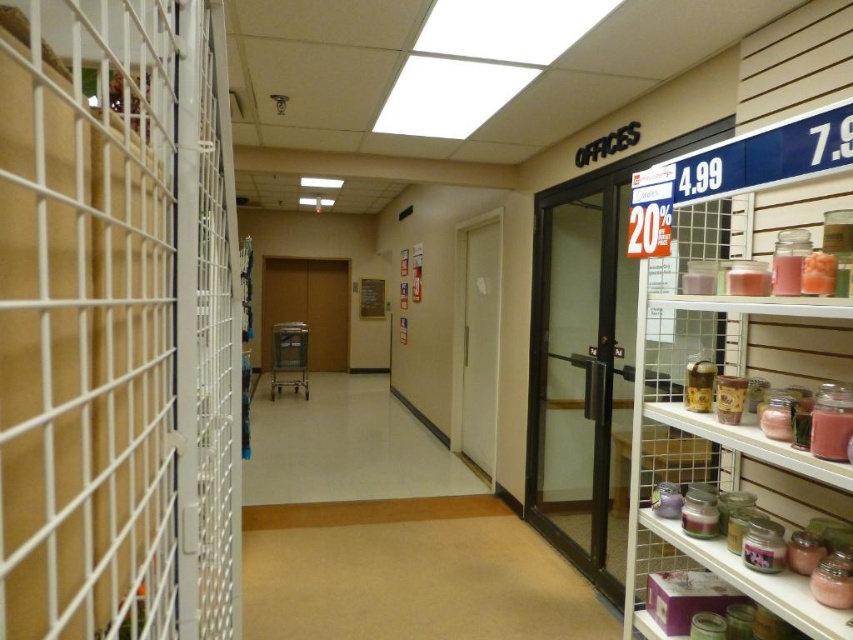
Measure the distance between point (x=160, y=515) and camera.

Point (x=160, y=515) and camera are 95.80 centimeters apart.

Which is more to the right, white wire mesh cage at left or pink glass jars at right?

Positioned to the right is pink glass jars at right.

Identify the location of white wire mesh cage at left. This screenshot has width=853, height=640. (117, 323).